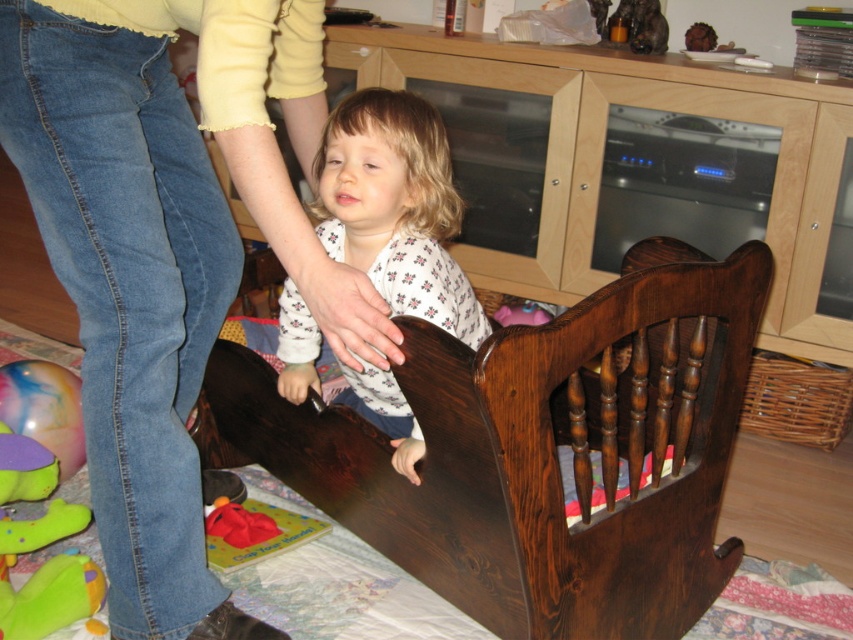
Question: Which is farther from the white floral pajamas at center?

Choices:
 (A) denim jeans at lower left
 (B) soft plush toy at lower left
 (C) dark brown wood infant bed at center

Answer: (B)

Question: Which object is the farthest from the denim jeans at lower left?

Choices:
 (A) dark brown wood infant bed at center
 (B) white floral pajamas at center

Answer: (A)

Question: Does dark brown wood infant bed at center appear on the right side of white floral pajamas at center?

Choices:
 (A) no
 (B) yes

Answer: (B)

Question: Can you confirm if denim jeans at lower left is positioned to the left of white floral pajamas at center?

Choices:
 (A) yes
 (B) no

Answer: (A)

Question: Can you confirm if denim jeans at lower left is bigger than dark brown wood infant bed at center?

Choices:
 (A) yes
 (B) no

Answer: (B)

Question: Estimate the real-world distances between objects in this image. Which object is closer to the denim jeans at lower left?

Choices:
 (A) dark brown wood infant bed at center
 (B) white floral pajamas at center
 (C) soft plush toy at lower left

Answer: (B)